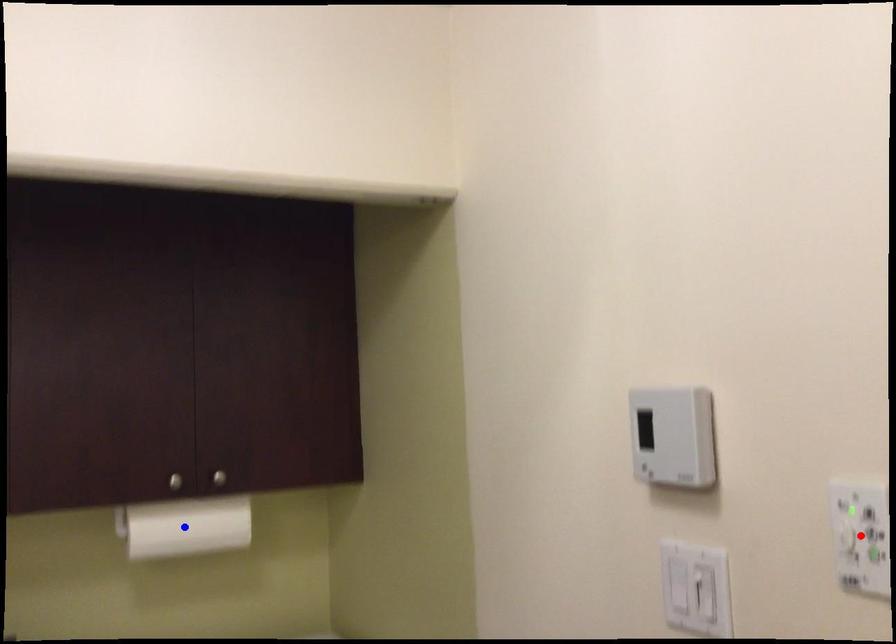
Question: Two points are marked on the image. Which point is closer to the camera?

Choices:
 (A) Blue point is closer.
 (B) Red point is closer.

Answer: (B)